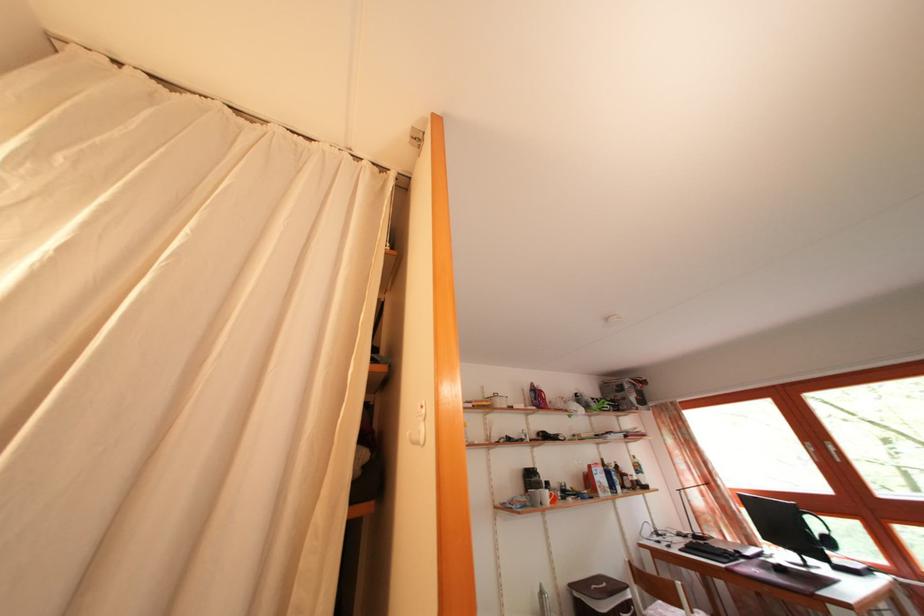
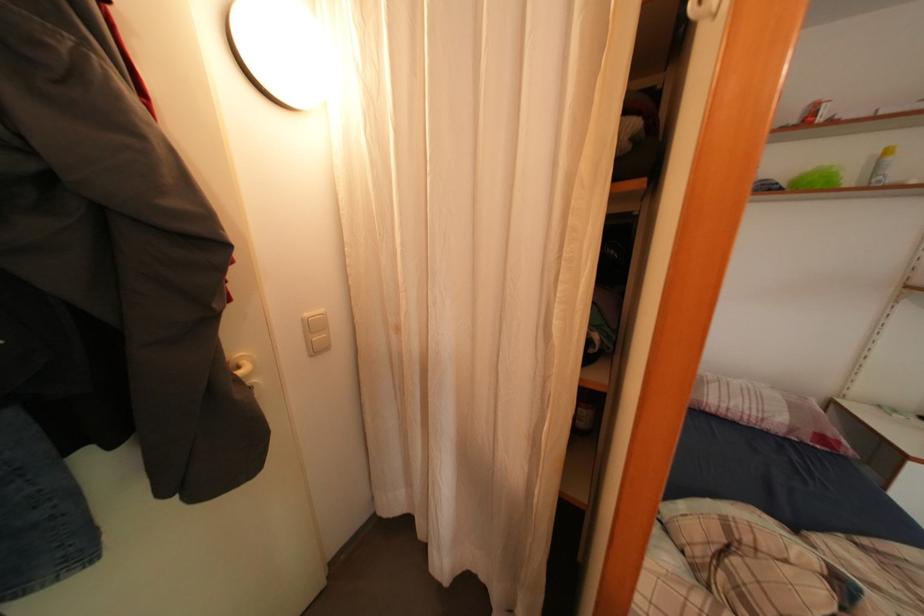
The images are taken continuously from a first-person perspective. In which direction is your viewpoint rotating?

The rotation direction of the camera is left-down.